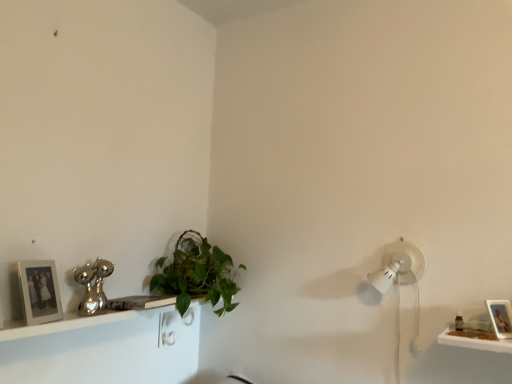
Question: Can you confirm if green leafy plant at center is wider than wooden photo frame at lower right, the second picture frame in the left-to-right sequence?

Choices:
 (A) no
 (B) yes

Answer: (B)

Question: Is wooden photo frame at lower right, the second picture frame in the left-to-right sequence, surrounded by green leafy plant at center?

Choices:
 (A) yes
 (B) no

Answer: (B)

Question: Is green leafy plant at center closer to camera compared to wooden photo frame at lower right, which is counted as the 1th picture frame, starting from the right?

Choices:
 (A) no
 (B) yes

Answer: (A)

Question: Is green leafy plant at center at the left side of wooden photo frame at lower right, which is counted as the 1th picture frame, starting from the right?

Choices:
 (A) yes
 (B) no

Answer: (A)

Question: From the image's perspective, is green leafy plant at center on wooden photo frame at lower right, the second picture frame in the left-to-right sequence?

Choices:
 (A) yes
 (B) no

Answer: (A)

Question: Is point (162, 367) positioned closer to the camera than point (212, 302)?

Choices:
 (A) closer
 (B) farther

Answer: (B)

Question: Looking at their shapes, would you say white glossy shelf at lower left is wider or thinner than green leafy plant at center?

Choices:
 (A) thin
 (B) wide

Answer: (A)

Question: From the image's perspective, is white glossy shelf at lower left positioned above or below green leafy plant at center?

Choices:
 (A) below
 (B) above

Answer: (A)

Question: From their relative heights in the image, would you say white glossy shelf at lower left is taller or shorter than green leafy plant at center?

Choices:
 (A) tall
 (B) short

Answer: (B)

Question: Looking at the image, does white glossy shelf at lower left seem bigger or smaller compared to white matte picture frame at left, which is the 2th picture frame from right to left?

Choices:
 (A) small
 (B) big

Answer: (B)

Question: In the image, is white glossy shelf at lower left on the left side or the right side of white matte picture frame at left, which ranks as the 1th picture frame in left-to-right order?

Choices:
 (A) left
 (B) right

Answer: (B)

Question: Is white glossy shelf at lower left in front of or behind white matte picture frame at left, which ranks as the 1th picture frame in left-to-right order, in the image?

Choices:
 (A) front
 (B) behind

Answer: (A)

Question: Is white glossy shelf at lower left inside the boundaries of white matte picture frame at left, which ranks as the 1th picture frame in left-to-right order, or outside?

Choices:
 (A) inside
 (B) outside

Answer: (B)

Question: Considering the positions of white matte picture frame at left, which is the 2th picture frame from right to left, and white glossy shelf at lower left in the image, is white matte picture frame at left, which is the 2th picture frame from right to left, bigger or smaller than white glossy shelf at lower left?

Choices:
 (A) big
 (B) small

Answer: (B)

Question: Is white matte picture frame at left, which ranks as the 1th picture frame in left-to-right order, in front of or behind white glossy shelf at lower left in the image?

Choices:
 (A) front
 (B) behind

Answer: (B)